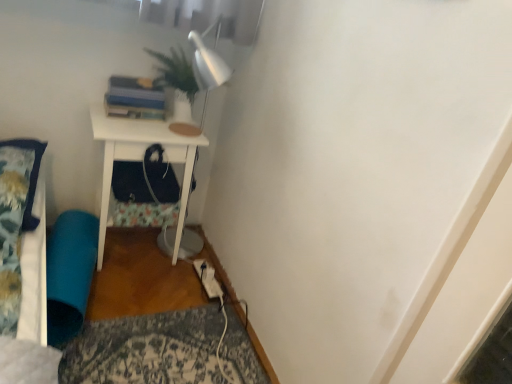
I want to click on free space to the back side of teal fabric bean bag at lower left, so click(x=129, y=255).